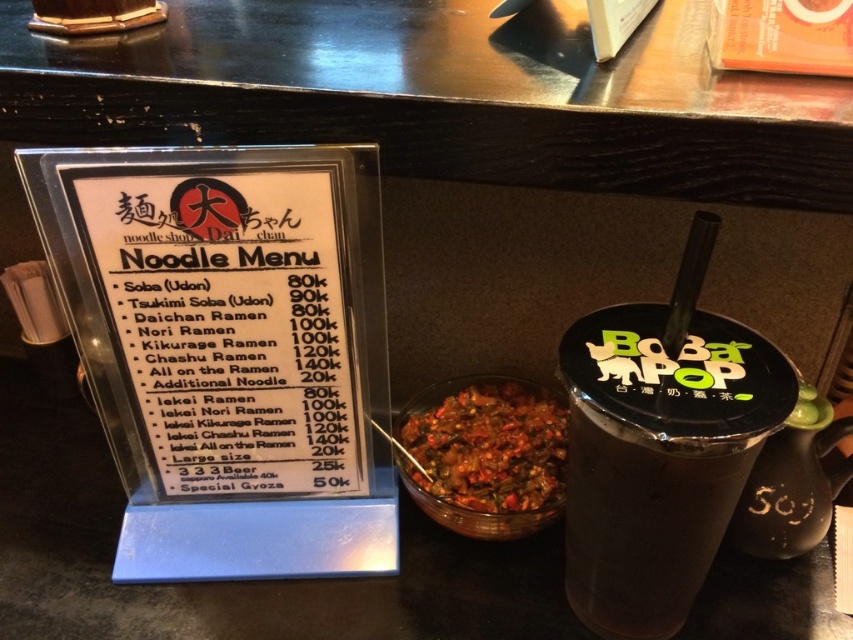
You are a customer at the restaurant counter. You want to order a drink but need to look at the menu first. However, the dark brown smooth cup at right is blocking your view of the white plastic menu at center. Can you move the cup to the right to see the menu better?

The white plastic menu at center is positioned on the left side of the dark brown smooth cup at right, so moving the cup to the right would allow you to see the menu better.

You are a customer at the noodle shop Dai Chan. You want to grab the dark brown smooth cup at right but you can only reach 40 centimeters. Can you reach it?

The dark brown smooth cup at right is 44.29 centimeters from the camera, which is beyond your reach of 40 centimeters. You cannot reach it.